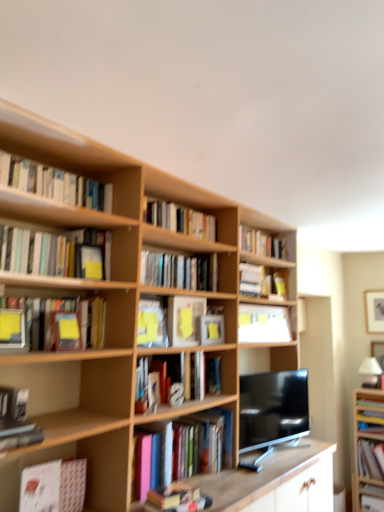
Question: Is matte black tv at center in front of white matte bookshelf at upper center, marked as the 6th book in a bottom-to-top arrangement?

Choices:
 (A) yes
 (B) no

Answer: (A)

Question: Does matte black tv at center have a lesser height compared to white matte bookshelf at upper center, marked as the 6th book in a bottom-to-top arrangement?

Choices:
 (A) no
 (B) yes

Answer: (A)

Question: From the image's perspective, is matte black tv at center beneath white matte bookshelf at upper center, marked as the 6th book in a bottom-to-top arrangement?

Choices:
 (A) no
 (B) yes

Answer: (B)

Question: Can you confirm if matte black tv at center is wider than white matte bookshelf at upper center, marked as the 6th book in a bottom-to-top arrangement?

Choices:
 (A) no
 (B) yes

Answer: (B)

Question: Does matte black tv at center have a greater height compared to white matte bookshelf at upper center, the eighth book in the top-to-bottom sequence?

Choices:
 (A) yes
 (B) no

Answer: (A)

Question: Is matte black tv at center surrounding white matte bookshelf at upper center, marked as the 6th book in a bottom-to-top arrangement?

Choices:
 (A) yes
 (B) no

Answer: (B)

Question: From a real-world perspective, is yellow matte paper at upper left, which is counted as the 2th paperback book, starting from the left, over yellow matte paper at center, the 1th paperback book viewed from the back?

Choices:
 (A) yes
 (B) no

Answer: (A)

Question: Considering the relative positions of yellow matte paper at upper left, which is the third paperback book in back-to-front order, and yellow matte paper at center, the first paperback book positioned from the right, in the image provided, is yellow matte paper at upper left, which is the third paperback book in back-to-front order, to the right of yellow matte paper at center, the first paperback book positioned from the right, from the viewer's perspective?

Choices:
 (A) yes
 (B) no

Answer: (B)

Question: Does yellow matte paper at upper left, which is counted as the 2th paperback book, starting from the left, come behind yellow matte paper at center, the 1th paperback book viewed from the back?

Choices:
 (A) no
 (B) yes

Answer: (A)

Question: From a real-world perspective, is yellow matte paper at upper left, which is the third paperback book in back-to-front order, located beneath yellow matte paper at center, the 4th paperback book in the front-to-back sequence?

Choices:
 (A) yes
 (B) no

Answer: (B)

Question: Can you confirm if yellow matte paper at upper left, which is the third paperback book in back-to-front order, is shorter than yellow matte paper at center, the 1th paperback book viewed from the back?

Choices:
 (A) no
 (B) yes

Answer: (A)

Question: Could yellow matte paper at center, which ranks as the fourth paperback book in left-to-right order, be considered to be inside yellow matte paper at upper left, which ranks as the 3th paperback book in right-to-left order?

Choices:
 (A) no
 (B) yes

Answer: (A)

Question: Is hardcover book at center, the 8th book in the bottom-to-top sequence, further to camera compared to matte white book at lower right, the 13th book when ordered from top to bottom?

Choices:
 (A) yes
 (B) no

Answer: (B)